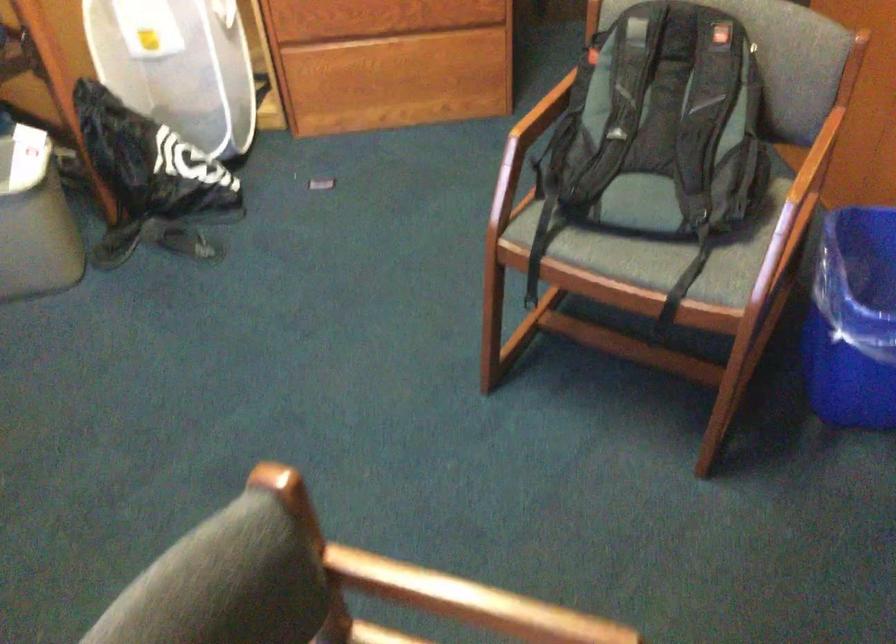
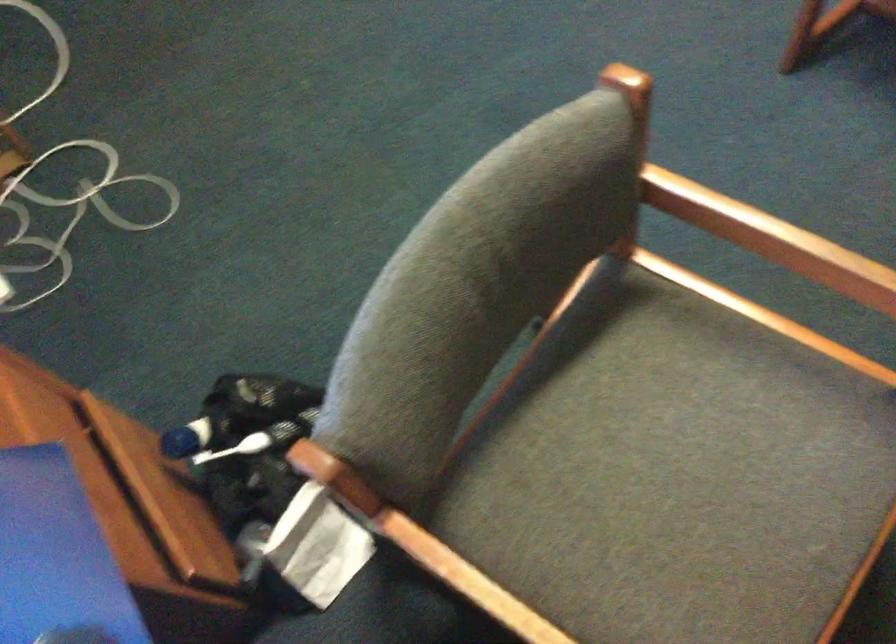
Question: Based on the continuous images, in which direction is the camera rotating? Reply with the corresponding letter.

Choices:
 (A) Left
 (B) Right
 (C) Up
 (D) Down

Answer: (D)